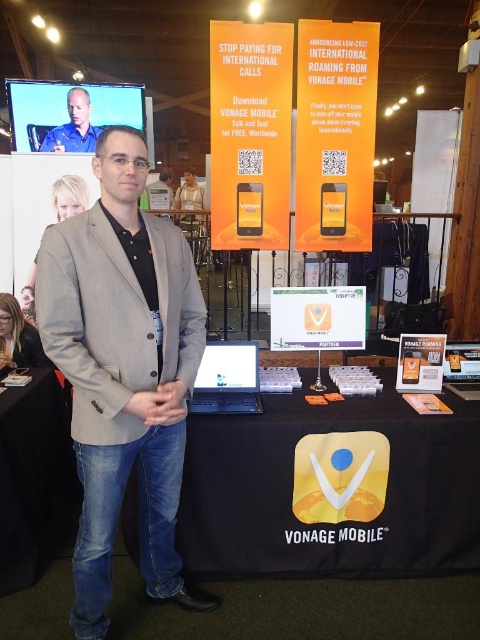
Which is more to the right, black fabric table at center or gray fabric blazer at center?

black fabric table at center

Who is lower down, black fabric table at center or gray fabric blazer at center?

black fabric table at center is below.

The image size is (480, 640). Find the location of `black fabric table at center`. black fabric table at center is located at coordinates (332, 488).

Which is more to the right, gray fabric blazer at center or matte blue shirt at upper left?

gray fabric blazer at center is more to the right.

Based on the photo, who is more distant from viewer, (72, 404) or (51, 141)?

Positioned behind is point (51, 141).

The image size is (480, 640). Find the location of `gray fabric blazer at center`. gray fabric blazer at center is located at coordinates (122, 371).

Image resolution: width=480 pixels, height=640 pixels. I want to click on gray fabric blazer at center, so click(122, 371).

Is black fabric table at center below matte blue shirt at upper left?

Yes.

Is black fabric table at center positioned at the back of matte blue shirt at upper left?

No.

You are a GUI agent. You are given a task and a screenshot of the screen. Output one action in this format:
    pyautogui.click(x=<x>, y=<y>)
    Task: Click on the black fabric table at center
    This screenshot has width=480, height=640.
    Given the screenshot: What is the action you would take?
    pyautogui.click(x=332, y=488)